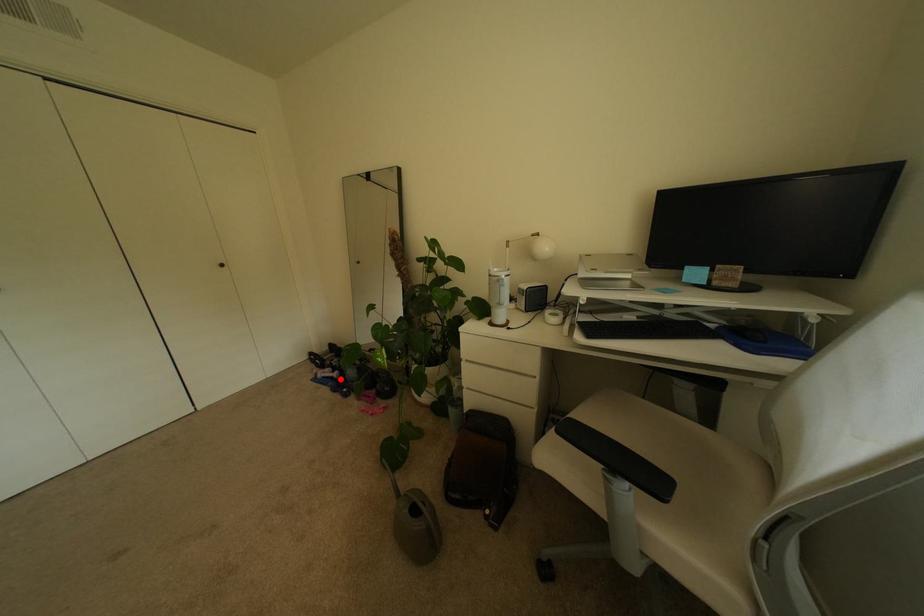
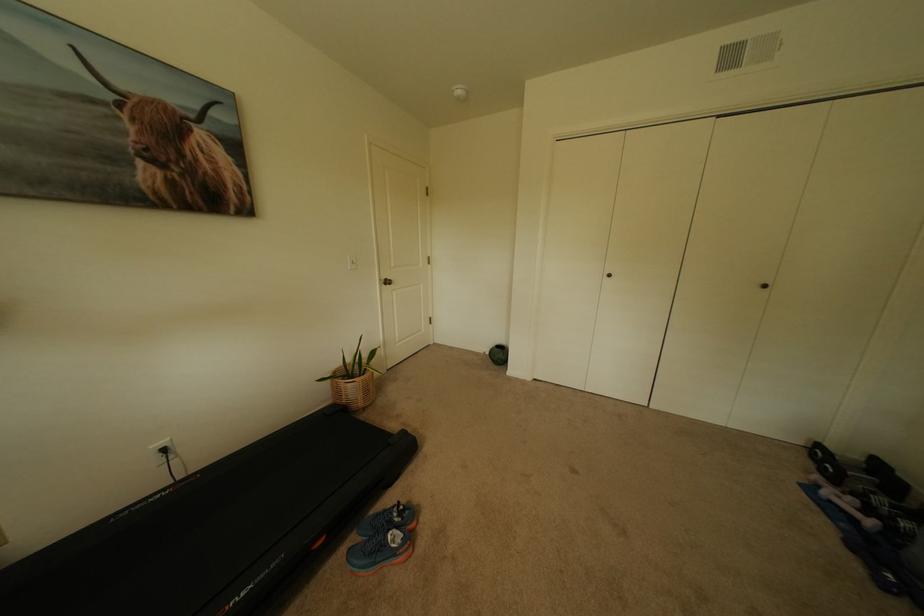
In the second image, find the point that corresponds to the highlighted location in the first image.

(862, 521)